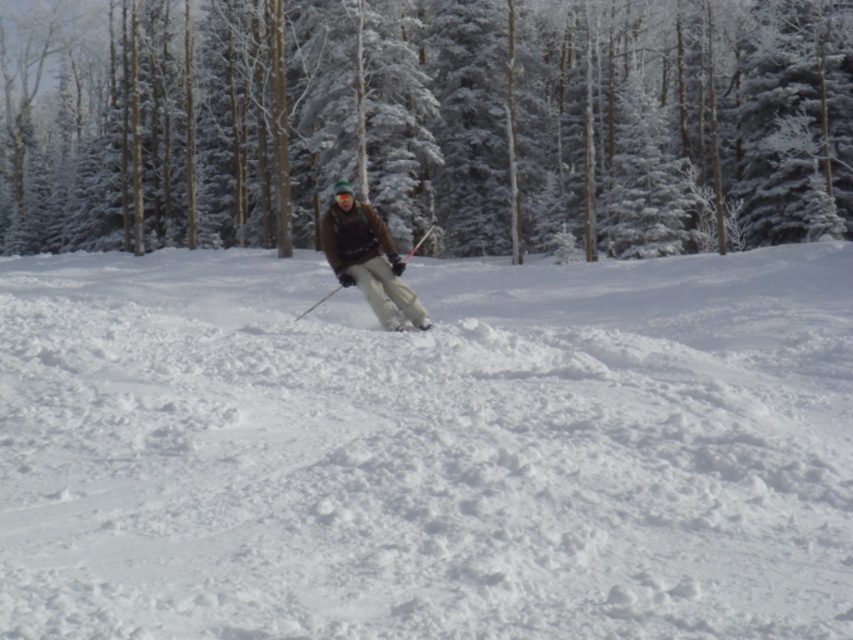
Is point (410, 323) more distant than point (338, 192)?

That is False.

Can you confirm if white matte ski at center is shorter than green fuzzy goggles at center?

Yes.

This screenshot has height=640, width=853. Describe the element at coordinates (410, 326) in the screenshot. I see `white matte ski at center` at that location.

Find the location of a particular element. Image resolution: width=853 pixels, height=640 pixels. white matte ski at center is located at coordinates (410, 326).

Who is shorter, white fluffy snow at center or white matte ski at center?

With less height is white matte ski at center.

Looking at this image, can you confirm if white fluffy snow at center is taller than white matte ski at center?

Yes.

The height and width of the screenshot is (640, 853). What are the coordinates of `white fluffy snow at center` in the screenshot? It's located at (426, 448).

Is white fluffy snow at center to the left of green fuzzy goggles at center from the viewer's perspective?

In fact, white fluffy snow at center is to the right of green fuzzy goggles at center.

Who is positioned more to the left, white fluffy snow at center or green fuzzy goggles at center?

green fuzzy goggles at center is more to the left.

Find the location of `white fluffy snow at center`. white fluffy snow at center is located at coordinates (426, 448).

This screenshot has width=853, height=640. In order to click on white fluffy snow at center in this screenshot , I will do `click(426, 448)`.